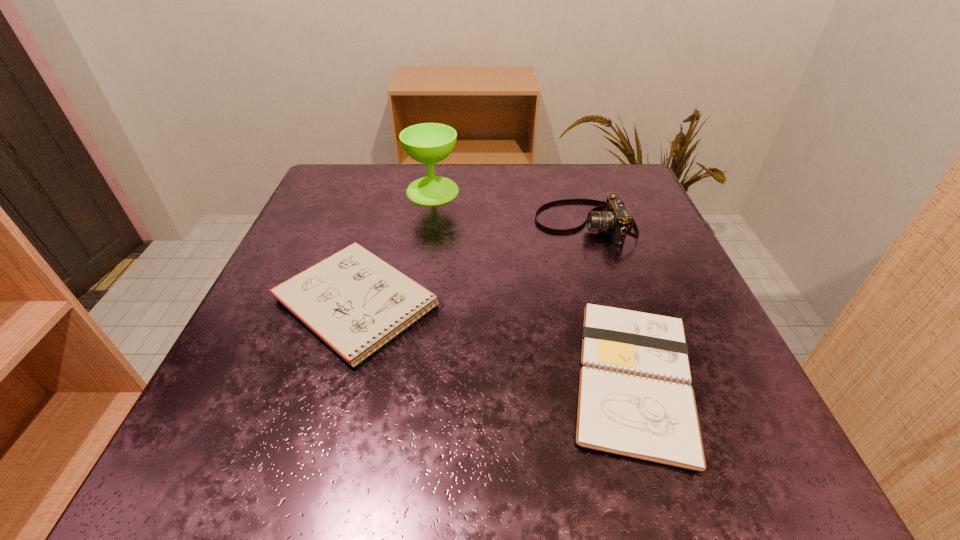
You are a GUI agent. You are given a task and a screenshot of the screen. Output one action in this format:
    pyautogui.click(x=<x>, y=<y>)
    Task: Click on the vacant area at the far edge of the desktop
    This screenshot has width=960, height=540.
    Given the screenshot: What is the action you would take?
    pyautogui.click(x=545, y=166)

Locate an element on the screen. This screenshot has width=960, height=540. vacant space at the left edge of the desktop is located at coordinates (258, 309).

The height and width of the screenshot is (540, 960). What are the coordinates of `free space at the right edge of the desktop` in the screenshot? It's located at (659, 303).

At what (x,y) coordinates should I click in order to perform the action: click on free space at the near left corner of the desktop. Please return your answer as a coordinate pair (x, y). This screenshot has height=540, width=960. Looking at the image, I should click on (203, 475).

In the image, there is a desktop. Find the location of `vacant space at the far right corner`. vacant space at the far right corner is located at coordinates (578, 168).

You are a GUI agent. You are given a task and a screenshot of the screen. Output one action in this format:
    pyautogui.click(x=<x>, y=<y>)
    Task: Click on the free space at the near right corner
    This screenshot has width=960, height=540.
    Given the screenshot: What is the action you would take?
    pyautogui.click(x=759, y=464)

The image size is (960, 540). What are the coordinates of `free area in between the taller notepad and the tallest object` in the screenshot? It's located at (395, 247).

Where is `empty location between the third tallest object and the camera`? empty location between the third tallest object and the camera is located at coordinates (471, 263).

You are a GUI agent. You are given a task and a screenshot of the screen. Output one action in this format:
    pyautogui.click(x=<x>, y=<y>)
    Task: Click on the empty space that is in between the third shortest object and the left notepad
    This screenshot has width=960, height=540.
    Given the screenshot: What is the action you would take?
    pyautogui.click(x=471, y=263)

You are a GUI agent. You are given a task and a screenshot of the screen. Output one action in this format:
    pyautogui.click(x=<x>, y=<y>)
    Task: Click on the free point between the third tallest object and the wineglass
    The width and height of the screenshot is (960, 540).
    Given the screenshot: What is the action you would take?
    pyautogui.click(x=395, y=247)